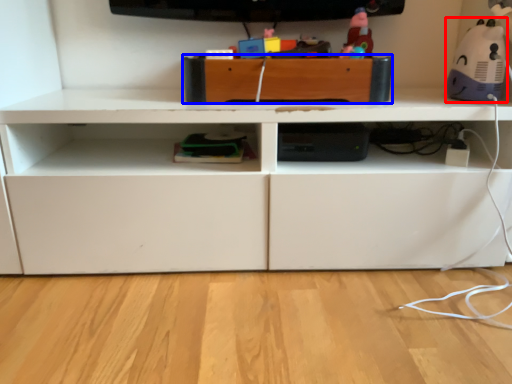
Question: Among these objects, which one is farthest to the camera, toy (highlighted by a red box) or drawer (highlighted by a blue box)?

Choices:
 (A) toy
 (B) drawer

Answer: (B)